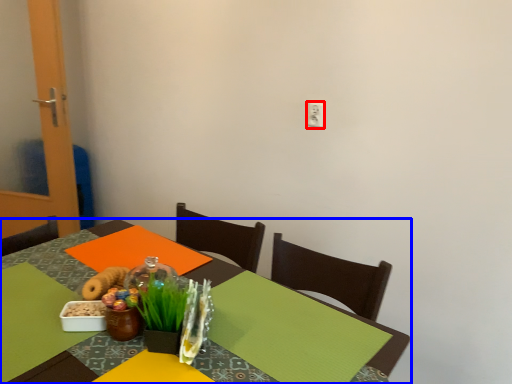
Question: Which object is further to the camera taking this photo, electric outlet (highlighted by a red box) or table (highlighted by a blue box)?

Choices:
 (A) electric outlet
 (B) table

Answer: (A)